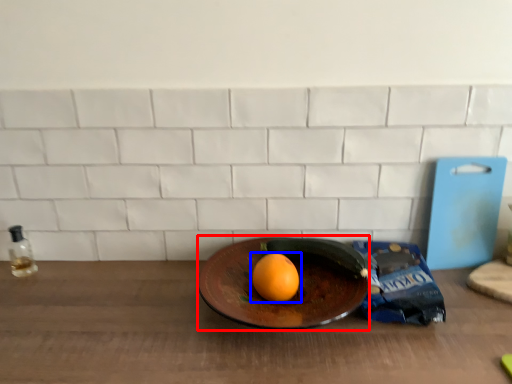
Question: Which point is further to the camera, plate (highlighted by a red box) or grapefruit (highlighted by a blue box)?

Choices:
 (A) plate
 (B) grapefruit

Answer: (B)